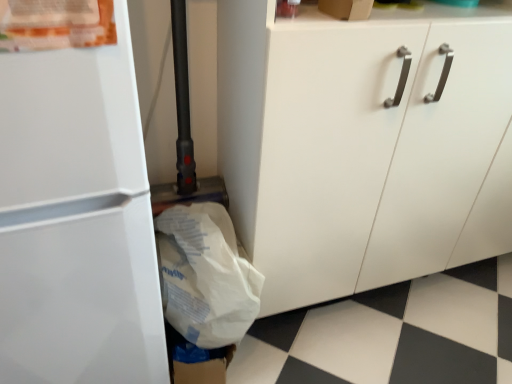
Question: Is white matte cabinet at center not within white glossy refrigerator at left?

Choices:
 (A) no
 (B) yes

Answer: (B)

Question: Is white matte cabinet at center closer to camera compared to white glossy refrigerator at left?

Choices:
 (A) yes
 (B) no

Answer: (B)

Question: Is white matte cabinet at center bigger than white glossy refrigerator at left?

Choices:
 (A) yes
 (B) no

Answer: (A)

Question: Is white matte cabinet at center aimed at white glossy refrigerator at left?

Choices:
 (A) no
 (B) yes

Answer: (A)

Question: Are white matte cabinet at center and white glossy refrigerator at left beside each other?

Choices:
 (A) no
 (B) yes

Answer: (A)

Question: Is white matte cabinet at center at the right side of white glossy refrigerator at left?

Choices:
 (A) no
 (B) yes

Answer: (B)

Question: From the image's perspective, would you say white paper grocery bag at lower left is shown under white glossy refrigerator at left?

Choices:
 (A) yes
 (B) no

Answer: (A)

Question: Considering the relative positions of white paper grocery bag at lower left and white glossy refrigerator at left in the image provided, is white paper grocery bag at lower left behind white glossy refrigerator at left?

Choices:
 (A) yes
 (B) no

Answer: (A)

Question: Does white paper grocery bag at lower left have a greater width compared to white glossy refrigerator at left?

Choices:
 (A) no
 (B) yes

Answer: (A)

Question: Does white paper grocery bag at lower left have a lesser width compared to white glossy refrigerator at left?

Choices:
 (A) yes
 (B) no

Answer: (A)

Question: Considering the relative positions of white paper grocery bag at lower left and white glossy refrigerator at left in the image provided, is white paper grocery bag at lower left to the right of white glossy refrigerator at left from the viewer's perspective?

Choices:
 (A) no
 (B) yes

Answer: (B)

Question: From a real-world perspective, is white paper grocery bag at lower left positioned under white glossy refrigerator at left based on gravity?

Choices:
 (A) yes
 (B) no

Answer: (A)

Question: Is white matte cabinet at center completely or partially inside white glossy refrigerator at left?

Choices:
 (A) yes
 (B) no

Answer: (B)